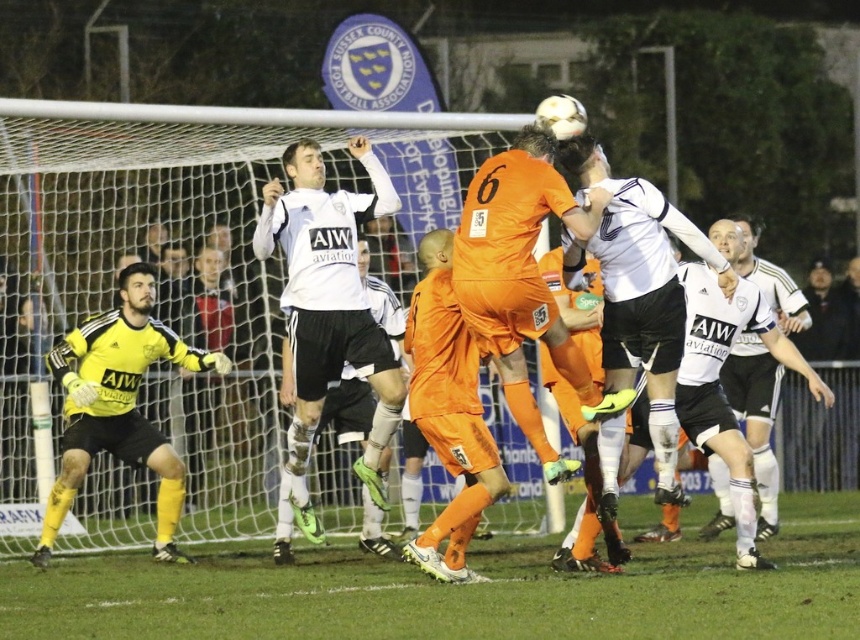
Question: Is orange matte soccer player at center in front of yellow matte gloves at left?

Choices:
 (A) no
 (B) yes

Answer: (B)

Question: Does white mesh net at center come in front of orange jersey at center?

Choices:
 (A) no
 (B) yes

Answer: (A)

Question: Is white matte soccer player at center smaller than white matte jersey at center?

Choices:
 (A) no
 (B) yes

Answer: (A)

Question: Which of the following is the closest to the observer?

Choices:
 (A) white matte soccer player at center
 (B) green grass at lower center
 (C) white mesh net at center

Answer: (B)

Question: Which object is farther from the camera taking this photo?

Choices:
 (A) white matte jersey at upper center
 (B) white mesh net at center

Answer: (B)

Question: Estimate the real-world distances between objects in this image. Which object is closer to the orange matte soccer player at center?

Choices:
 (A) white matte soccer player at center
 (B) yellow matte gloves at left
 (C) white mesh net at center
 (D) orange jersey at center

Answer: (D)